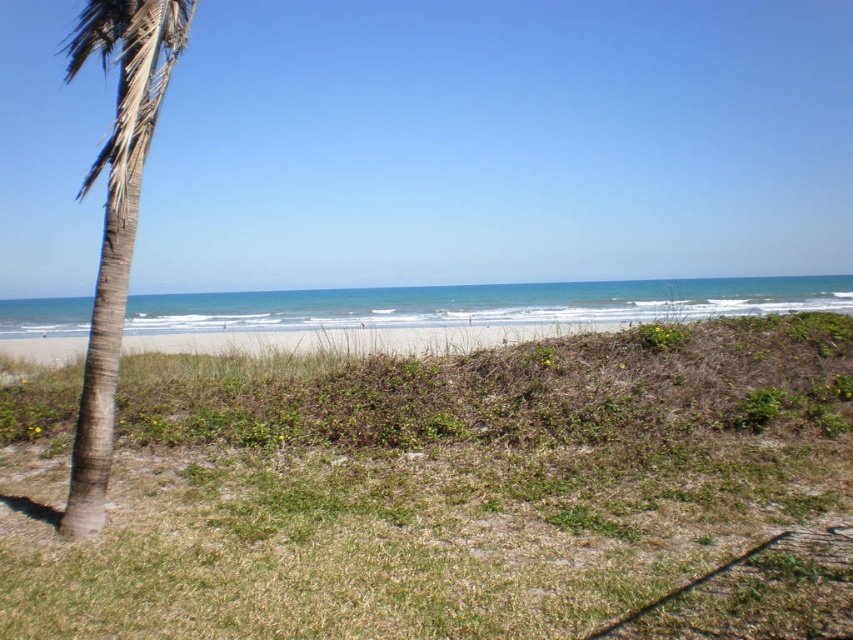
Can you confirm if green grass at lower left is thinner than brown textured palm tree at left?

Yes.

In the scene shown: Is green grass at lower left below brown textured palm tree at left?

Correct, green grass at lower left is located below brown textured palm tree at left.

Who is more distant from viewer, (331,428) or (112,8)?

The point (331,428) is behind.

This screenshot has height=640, width=853. Find the location of `green grass at lower left`. green grass at lower left is located at coordinates (445, 484).